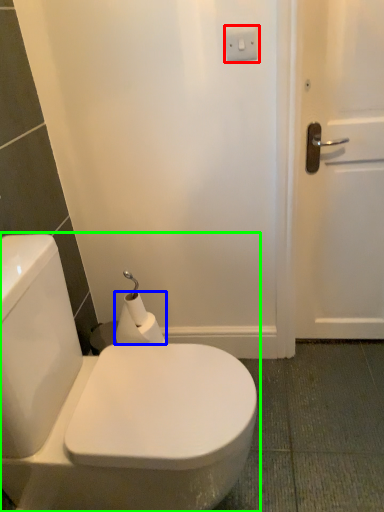
Question: Which is farther away from electric outlet (highlighted by a red box)? toilet paper (highlighted by a blue box) or toilet (highlighted by a green box)?

Choices:
 (A) toilet paper
 (B) toilet

Answer: (B)